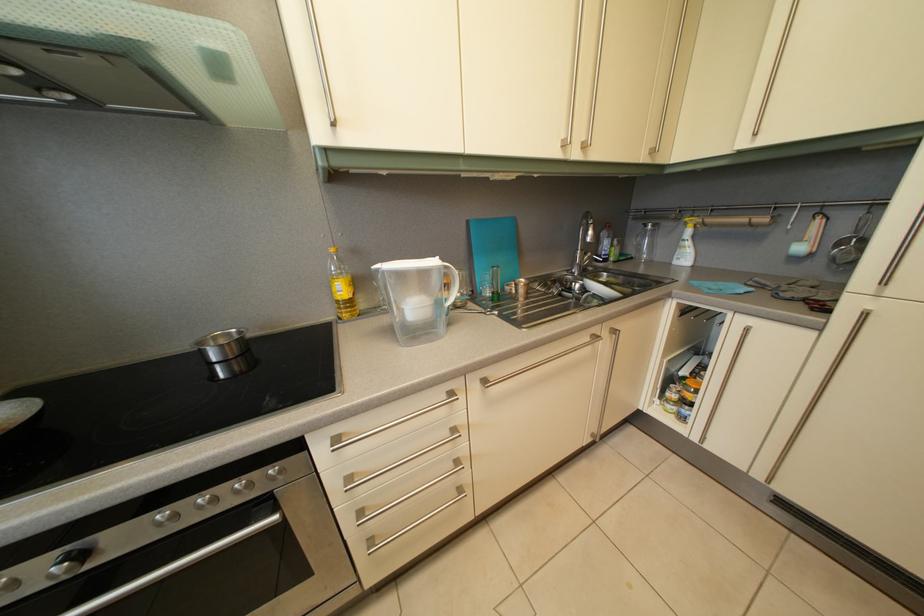
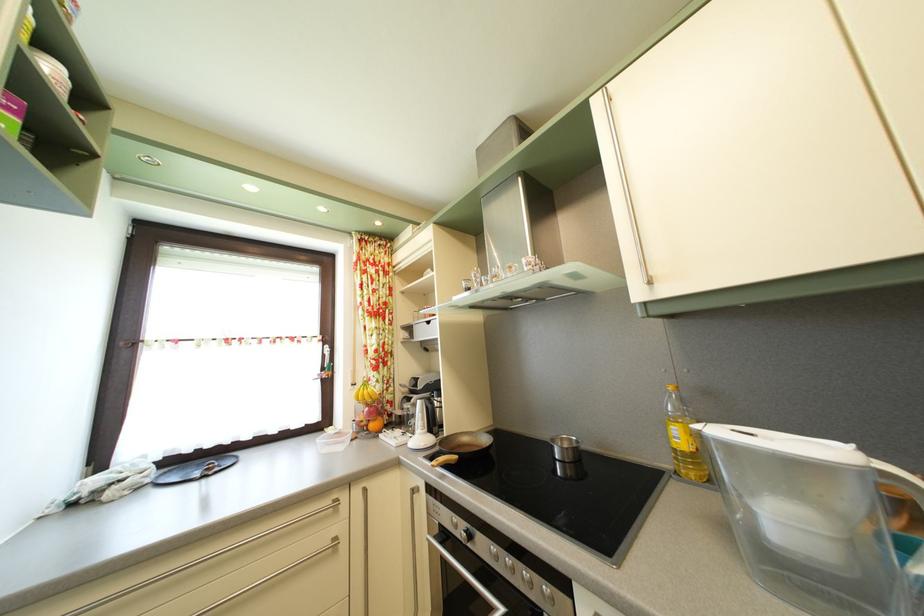
Where in the second image is the point corresponding to (241,500) from the first image?

(529, 584)